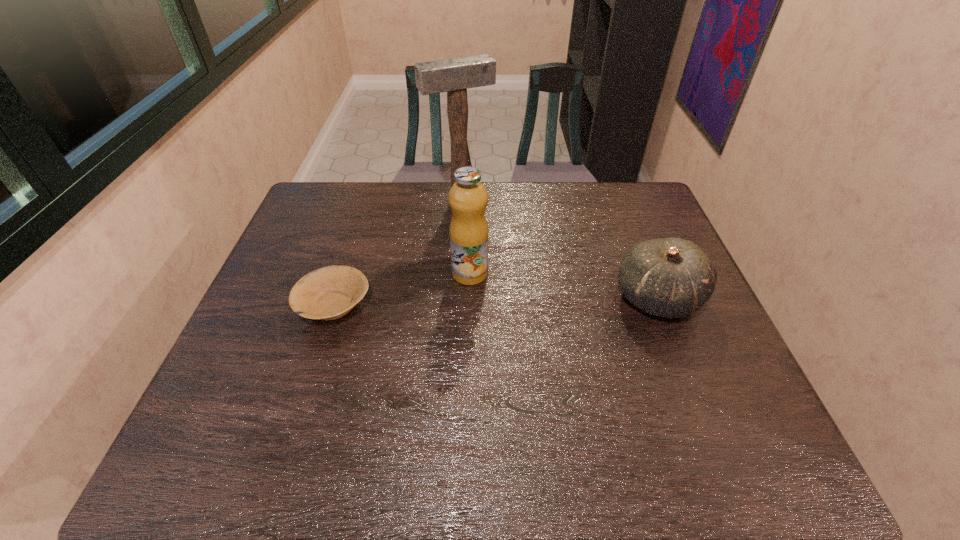
In the image, there is a desktop. Identify the location of free space at the left edge. The height and width of the screenshot is (540, 960). (315, 259).

Locate an element on the screen. The image size is (960, 540). vacant space at the right edge of the desktop is located at coordinates (699, 350).

In order to click on free space at the far left corner in this screenshot , I will do tap(322, 195).

Find the location of a particular element. This screenshot has width=960, height=540. free space at the far right corner is located at coordinates (643, 199).

At what (x,y) coordinates should I click in order to perform the action: click on empty space that is in between the third shortest object and the bowl. Please return your answer as a coordinate pair (x, y). This screenshot has height=540, width=960. Looking at the image, I should click on (402, 289).

Locate an element on the screen. This screenshot has height=540, width=960. vacant area that lies between the mallet and the rightmost object is located at coordinates (559, 249).

This screenshot has width=960, height=540. Identify the location of vacant area that lies between the rightmost object and the tallest object. 559,249.

Where is `vacant point located between the bowl and the mallet`? vacant point located between the bowl and the mallet is located at coordinates (397, 253).

Where is `empty location between the fruit juice and the gourd`? This screenshot has height=540, width=960. empty location between the fruit juice and the gourd is located at coordinates (564, 286).

The height and width of the screenshot is (540, 960). What are the coordinates of `free space between the gourd and the mallet` in the screenshot? It's located at (559, 249).